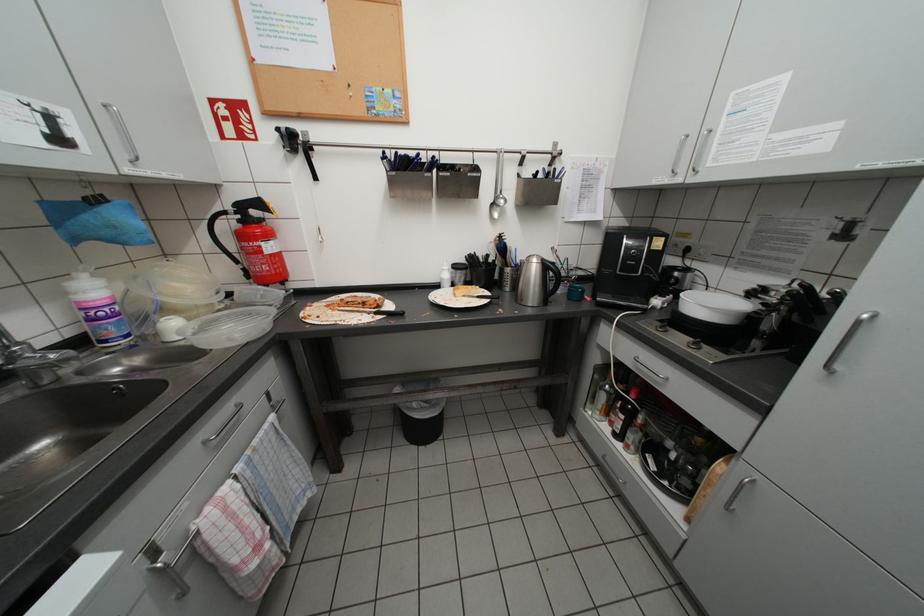
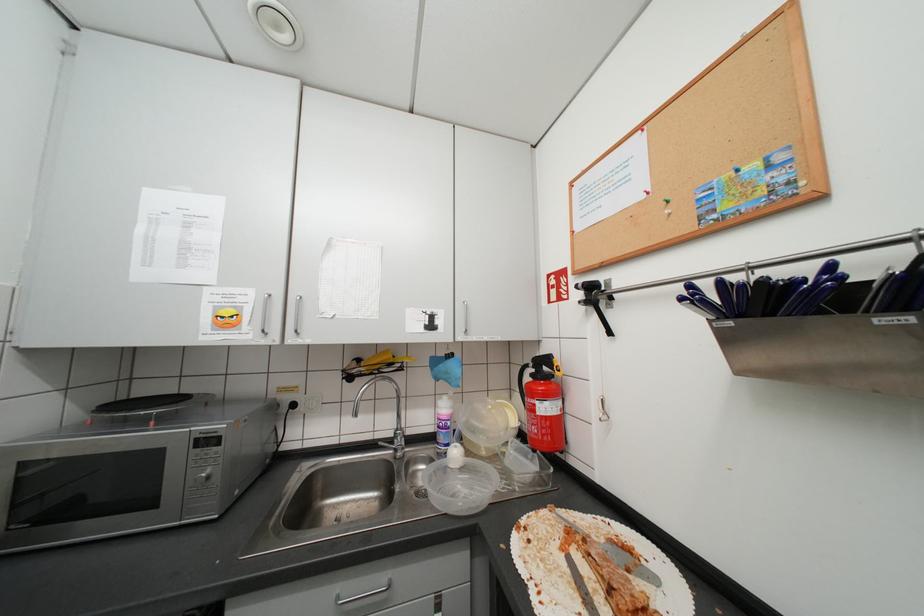
Question: The camera is either moving clockwise (left) or counter-clockwise (right) around the object. The first image is from the beginning of the video and the second image is from the end. Is the camera moving left or right when shooting the video?

Choices:
 (A) Left
 (B) Right

Answer: (B)